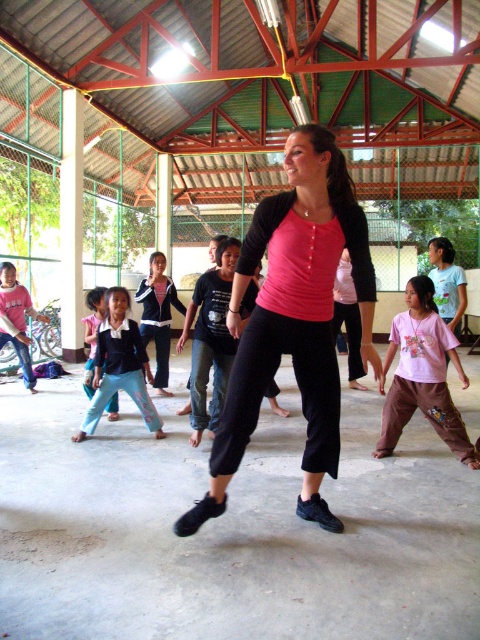
Question: Is pink cotton shirt at center behind light blue cotton pants at lower left?

Choices:
 (A) no
 (B) yes

Answer: (A)

Question: Which of the following is the closest to the observer?

Choices:
 (A) (x=336, y=525)
 (B) (x=410, y=385)
 (C) (x=159, y=387)

Answer: (A)

Question: Does pink cotton shirt at center have a smaller size compared to light blue cotton pants at lower left?

Choices:
 (A) no
 (B) yes

Answer: (A)

Question: Does blue cotton pants at center appear on the left side of light blue cotton pants at lower left?

Choices:
 (A) yes
 (B) no

Answer: (B)

Question: Among these points, which one is farthest from the camera?

Choices:
 (A) (153, 266)
 (B) (423, 362)
 (C) (151, 428)

Answer: (A)

Question: Among these points, which one is farthest from the camera?

Choices:
 (A) (152, 291)
 (B) (98, 310)
 (C) (302, 188)
 (D) (105, 394)

Answer: (A)